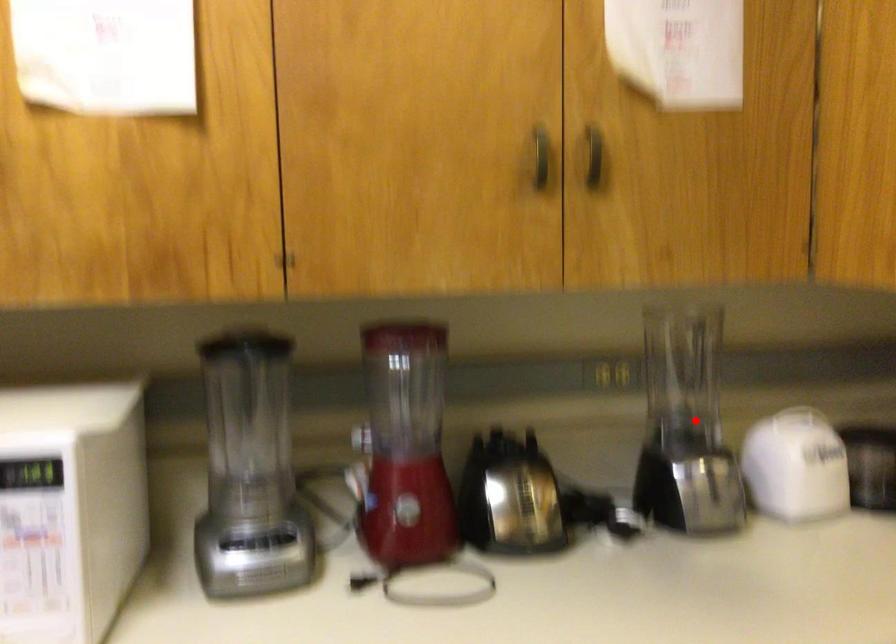
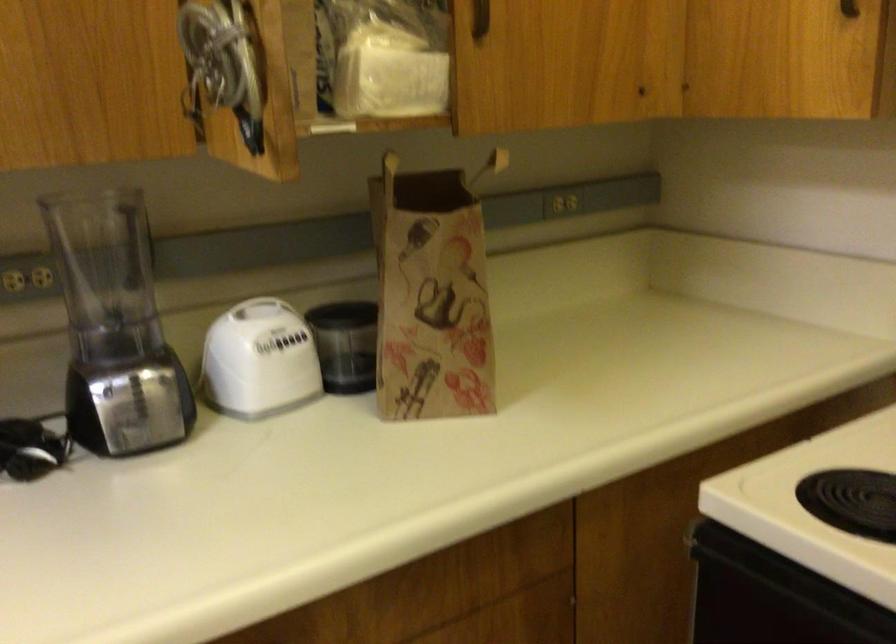
Question: A red point is marked in image1. In image2, is the corresponding 3D point closer to the camera or farther? Reply with the corresponding letter.

Choices:
 (A) The corresponding 3D point is closer.
 (B) The corresponding 3D point is farther.

Answer: (A)